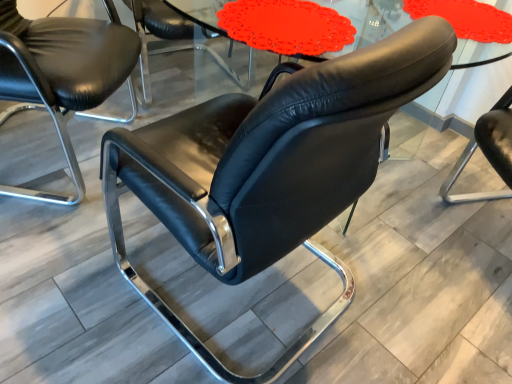
Question: From a real-world perspective, is black leather chair at center, arranged as the 3th chair when viewed from the back, positioned above or below black leather chair at left, arranged as the second chair when viewed from the back?

Choices:
 (A) above
 (B) below

Answer: (A)

Question: Is black leather chair at center, the 1th chair viewed from the front, in front of or behind black leather chair at left, arranged as the second chair when viewed from the front, in the image?

Choices:
 (A) front
 (B) behind

Answer: (A)

Question: Considering the real-world distances, which object is closest to the black leather chair at center, the 1th chair viewed from the front?

Choices:
 (A) black leather chair at center, arranged as the 1th chair when viewed from the back
 (B) matte glass table at center
 (C) black leather chair at left, arranged as the second chair when viewed from the back

Answer: (C)

Question: Considering the real-world distances, which object is farthest from the black leather chair at center, arranged as the 3th chair when viewed from the back?

Choices:
 (A) black leather chair at left, arranged as the second chair when viewed from the back
 (B) matte glass table at center
 (C) black leather chair at center, arranged as the 1th chair when viewed from the back

Answer: (B)